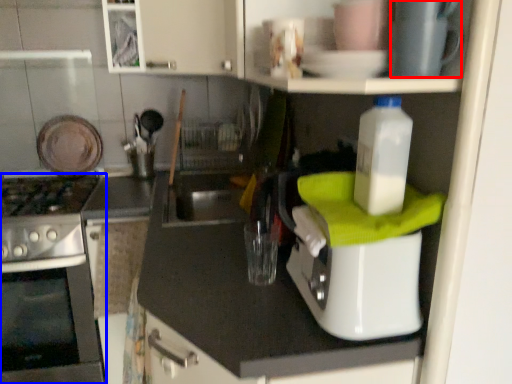
Question: Among these objects, which one is nearest to the camera, appliance (highlighted by a red box) or home appliance (highlighted by a blue box)?

Choices:
 (A) appliance
 (B) home appliance

Answer: (A)